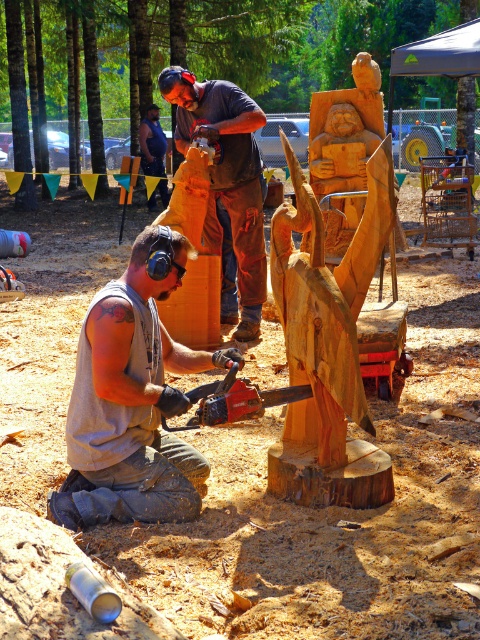
Who is more distant from viewer, (x=336, y=120) or (x=155, y=113)?

Positioned behind is point (x=155, y=113).

Between natural wood carving at center and dark blue shirt at upper center, which one appears on the left side from the viewer's perspective?

From the viewer's perspective, dark blue shirt at upper center appears more on the left side.

Is point (309, 342) positioned behind point (165, 141)?

No, it is in front of (165, 141).

Locate an element on the screen. This screenshot has height=640, width=480. natural wood carving at center is located at coordinates (332, 298).

Does gray fabric sleeveless shirt at lower left appear on the left side of wooden chainsaw at center?

Correct, you'll find gray fabric sleeveless shirt at lower left to the left of wooden chainsaw at center.

Is gray fabric sleeveless shirt at lower left below wooden chainsaw at center?

No.

Does point (100, 502) lie behind point (243, 384)?

No.

Find the location of a particular element. This screenshot has width=480, height=640. gray fabric sleeveless shirt at lower left is located at coordinates (132, 400).

Can you confirm if gray fabric sleeveless shirt at lower left is wider than dark blue shirt at upper center?

Yes.

Is gray fabric sleeveless shirt at lower left below dark blue shirt at upper center?

Yes.

Where is `gray fabric sleeveless shirt at lower left`? The width and height of the screenshot is (480, 640). gray fabric sleeveless shirt at lower left is located at coordinates (132, 400).

Locate an element on the screen. gray fabric sleeveless shirt at lower left is located at coordinates (132, 400).